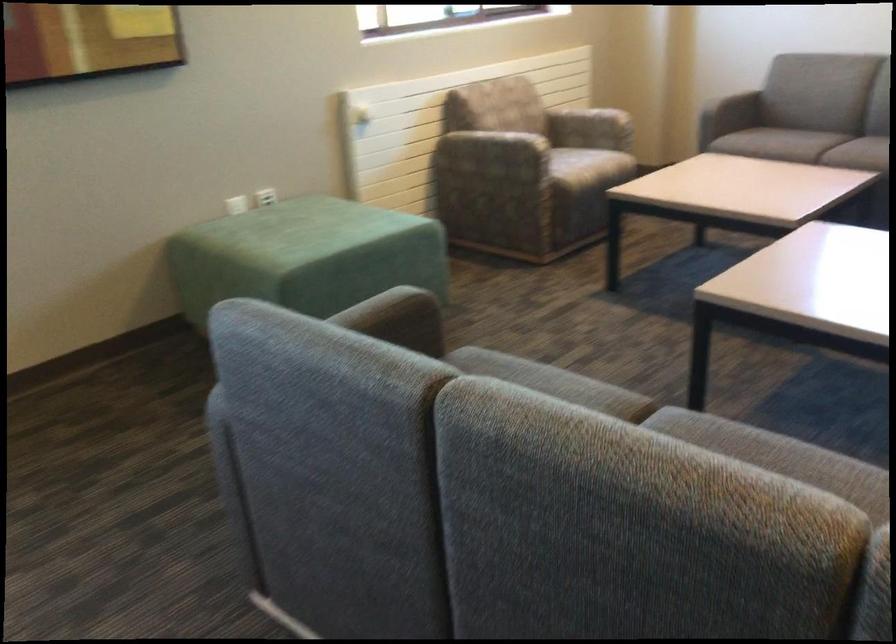
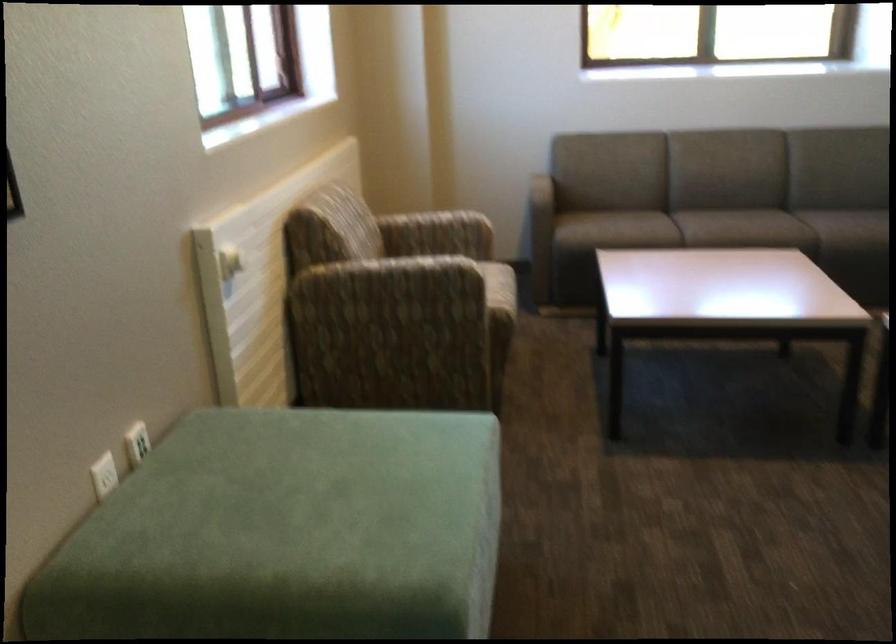
Find the pixel in the second image that matches the point at 352,115 in the first image.

(229, 263)